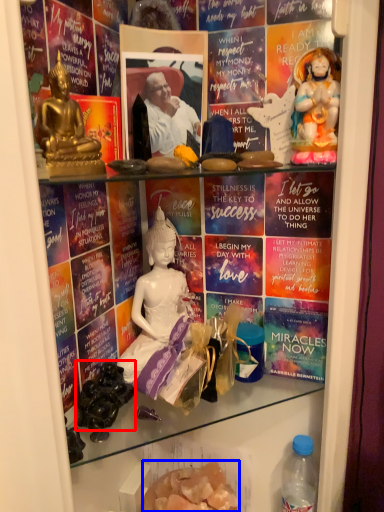
Question: Which of the following is the closest to the observer, food (highlighted by a red box) or food (highlighted by a blue box)?

Choices:
 (A) food
 (B) food

Answer: (A)